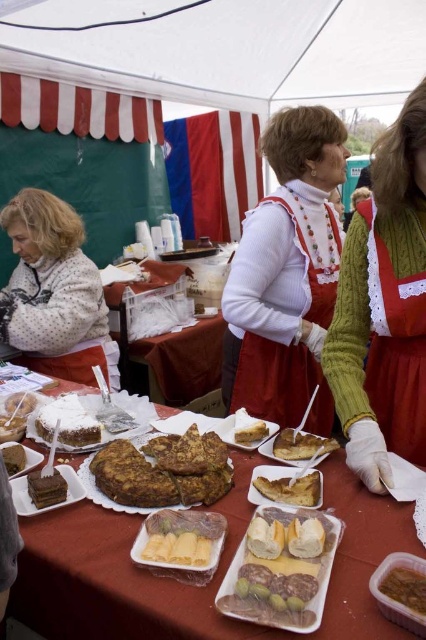
Question: Is green knitted sweater at upper right further to the viewer compared to golden brown bread at center?

Choices:
 (A) yes
 (B) no

Answer: (A)

Question: Which is farther from the green knitted sweater at upper right?

Choices:
 (A) matte plastic container at center
 (B) matte brown cake at center
 (C) white powdered cake at center
 (D) chocolate cake at center

Answer: (C)

Question: Among these points, which one is farthest from the camera?

Choices:
 (A) (69, 497)
 (B) (293, 488)
 (C) (204, 486)

Answer: (A)

Question: Can you confirm if matte plastic container at center is bigger than white powdered cake at center?

Choices:
 (A) no
 (B) yes

Answer: (A)

Question: Does green knitted sweater at upper right have a greater width compared to chocolate cake at center?

Choices:
 (A) no
 (B) yes

Answer: (B)

Question: Which point is farther to the camera?

Choices:
 (A) matte plastic container at center
 (B) golden brown cake at center
 (C) powdery white cake at lower left

Answer: (C)